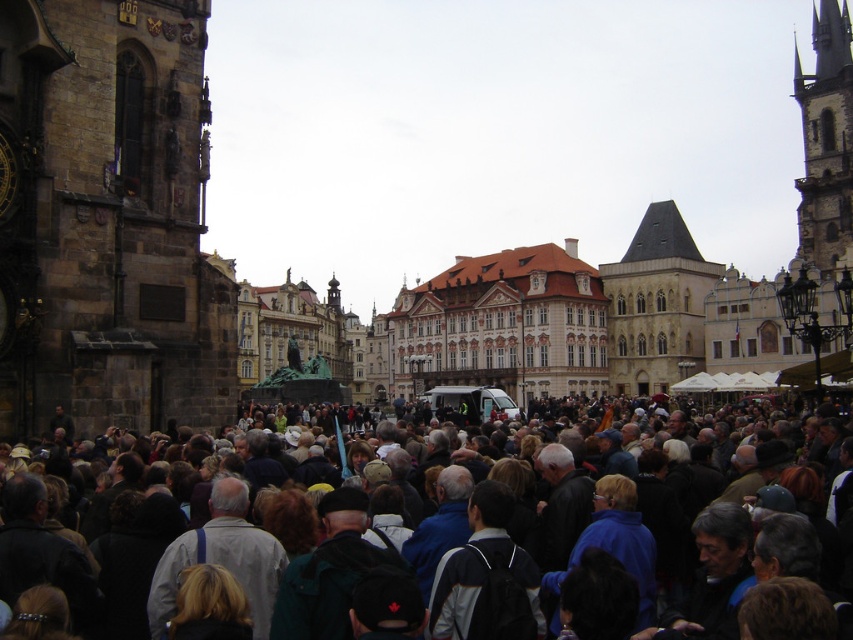
Is point (569, 240) positioned in front of point (833, 428)?

No, it is behind (833, 428).

Is brown stone building at center behind dark gray clothing at center?

Yes, brown stone building at center is further from the viewer.

The height and width of the screenshot is (640, 853). What do you see at coordinates (495, 326) in the screenshot? I see `brown stone building at center` at bounding box center [495, 326].

Locate an element on the screen. The width and height of the screenshot is (853, 640). brown stone building at center is located at coordinates (495, 326).

Which is above, stone clock tower at left or brown stone building at center?

stone clock tower at left

Is stone clock tower at left smaller than brown stone building at center?

Yes, stone clock tower at left is smaller than brown stone building at center.

The height and width of the screenshot is (640, 853). What do you see at coordinates (107, 218) in the screenshot?
I see `stone clock tower at left` at bounding box center [107, 218].

The image size is (853, 640). I want to click on stone clock tower at left, so click(x=107, y=218).

Does stone clock tower at left have a larger size compared to stone steeple at right?

No.

Identify the location of stone clock tower at left. Image resolution: width=853 pixels, height=640 pixels. pyautogui.click(x=107, y=218).

Identify the location of stone clock tower at left. This screenshot has width=853, height=640. click(107, 218).